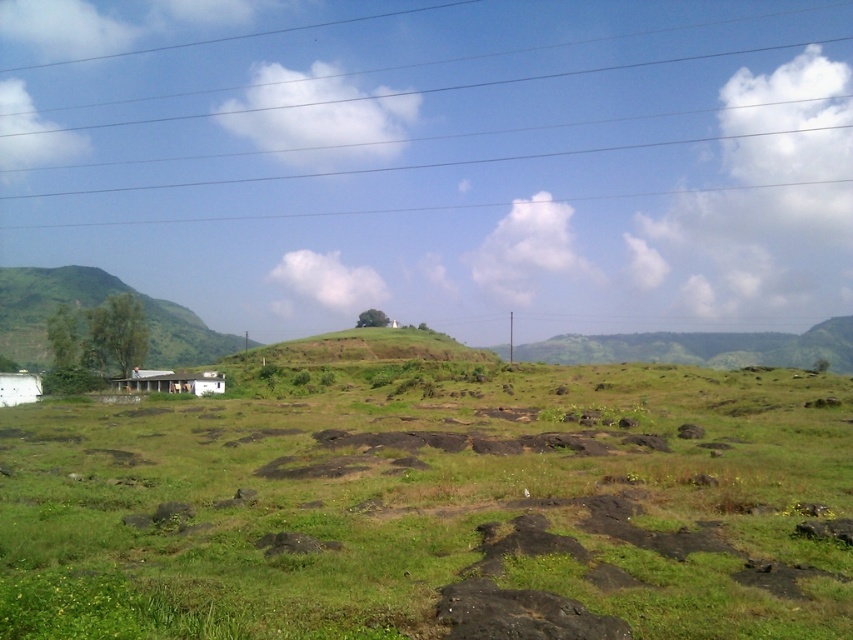
The height and width of the screenshot is (640, 853). Describe the element at coordinates (93, 307) in the screenshot. I see `green grassy hillside at left` at that location.

Is point (44, 362) positioned before point (171, 381)?

That is False.

Does point (3, 314) come closer to viewer compared to point (178, 380)?

No, (3, 314) is further to viewer.

Where is `green grassy hillside at left`? This screenshot has width=853, height=640. green grassy hillside at left is located at coordinates (93, 307).

Does metallic wires at upper center appear under green grassy at center?

Actually, metallic wires at upper center is above green grassy at center.

Identify the location of metallic wires at upper center. (434, 138).

This screenshot has width=853, height=640. I want to click on metallic wires at upper center, so click(x=434, y=138).

Does metallic wires at upper center have a larger size compared to green grassy hillside at left?

Yes, metallic wires at upper center is bigger than green grassy hillside at left.

Can you confirm if metallic wires at upper center is positioned above green grassy hillside at left?

Indeed, metallic wires at upper center is positioned over green grassy hillside at left.

Which is behind, point (427, 196) or point (45, 355)?

Positioned behind is point (427, 196).

Locate an element on the screen. The width and height of the screenshot is (853, 640). metallic wires at upper center is located at coordinates (434, 138).